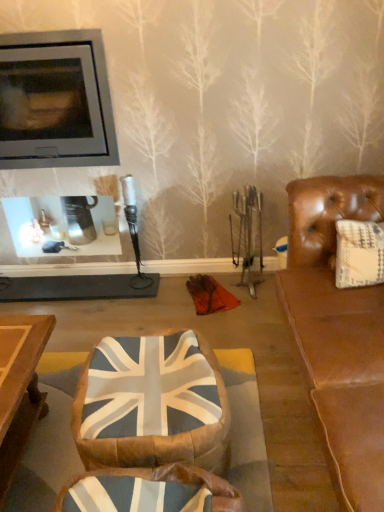
Question: Can you confirm if matte gray fireplace at upper left is taller than union jack fabric bean bag at center?

Choices:
 (A) yes
 (B) no

Answer: (A)

Question: Is there a large distance between matte gray fireplace at upper left and union jack fabric bean bag at center?

Choices:
 (A) yes
 (B) no

Answer: (A)

Question: Does matte gray fireplace at upper left appear on the right side of union jack fabric bean bag at center?

Choices:
 (A) yes
 (B) no

Answer: (B)

Question: From a real-world perspective, is matte gray fireplace at upper left over union jack fabric bean bag at center?

Choices:
 (A) no
 (B) yes

Answer: (B)

Question: Can you confirm if matte gray fireplace at upper left is bigger than union jack fabric bean bag at center?

Choices:
 (A) no
 (B) yes

Answer: (B)

Question: Is matte gray fireplace at upper left behind union jack fabric bean bag at center?

Choices:
 (A) yes
 (B) no

Answer: (A)

Question: Does union jack fabric bean bag at center have a greater height compared to matte gray fireplace at upper left?

Choices:
 (A) yes
 (B) no

Answer: (B)

Question: Is union jack fabric bean bag at center positioned behind matte gray fireplace at upper left?

Choices:
 (A) no
 (B) yes

Answer: (A)

Question: From the image's perspective, does union jack fabric bean bag at center appear lower than matte gray fireplace at upper left?

Choices:
 (A) no
 (B) yes

Answer: (B)

Question: Is there a large distance between union jack fabric bean bag at center and matte gray fireplace at upper left?

Choices:
 (A) yes
 (B) no

Answer: (A)

Question: Considering the relative sizes of union jack fabric bean bag at center and matte gray fireplace at upper left in the image provided, is union jack fabric bean bag at center wider than matte gray fireplace at upper left?

Choices:
 (A) yes
 (B) no

Answer: (A)

Question: Considering the relative positions of union jack fabric bean bag at center and matte gray fireplace at upper left in the image provided, is union jack fabric bean bag at center to the left of matte gray fireplace at upper left from the viewer's perspective?

Choices:
 (A) no
 (B) yes

Answer: (A)

Question: Considering the positions of union jack fabric bean bag at center and matte gray fireplace at upper left in the image, is union jack fabric bean bag at center bigger or smaller than matte gray fireplace at upper left?

Choices:
 (A) big
 (B) small

Answer: (B)